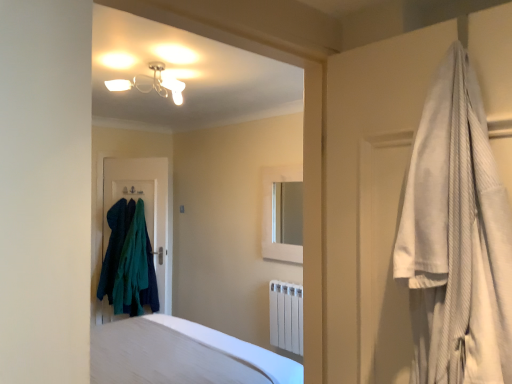
Question: Does white textured robe at right have a lesser height compared to white matte medicine cabinet at center?

Choices:
 (A) yes
 (B) no

Answer: (A)

Question: Is white textured robe at right positioned behind white matte medicine cabinet at center?

Choices:
 (A) no
 (B) yes

Answer: (A)

Question: Is white textured robe at right facing away from white matte medicine cabinet at center?

Choices:
 (A) no
 (B) yes

Answer: (A)

Question: Does white textured robe at right have a lesser width compared to white matte medicine cabinet at center?

Choices:
 (A) no
 (B) yes

Answer: (A)

Question: From the image's perspective, is white textured robe at right located above white matte medicine cabinet at center?

Choices:
 (A) no
 (B) yes

Answer: (B)

Question: From the image's perspective, is white textured robe at right under white matte medicine cabinet at center?

Choices:
 (A) yes
 (B) no

Answer: (B)

Question: Is dark teal fabric door at center facing towards white textured robe at right?

Choices:
 (A) yes
 (B) no

Answer: (B)

Question: Considering the relative sizes of dark teal fabric door at center and white textured robe at right in the image provided, is dark teal fabric door at center wider than white textured robe at right?

Choices:
 (A) yes
 (B) no

Answer: (B)

Question: Does dark teal fabric door at center touch white textured robe at right?

Choices:
 (A) yes
 (B) no

Answer: (B)

Question: Considering the relative positions of dark teal fabric door at center and white textured robe at right in the image provided, is dark teal fabric door at center to the left of white textured robe at right from the viewer's perspective?

Choices:
 (A) no
 (B) yes

Answer: (B)

Question: Is dark teal fabric door at center closer to the viewer compared to white textured robe at right?

Choices:
 (A) yes
 (B) no

Answer: (B)

Question: Can you confirm if dark teal fabric door at center is shorter than white textured robe at right?

Choices:
 (A) no
 (B) yes

Answer: (A)

Question: Is white smooth bed at lower center looking in the opposite direction of dark teal fabric door at center?

Choices:
 (A) yes
 (B) no

Answer: (B)